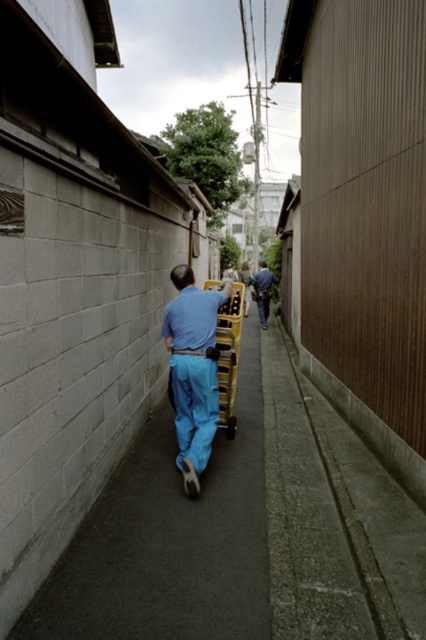
Question: Estimate the real-world distances between objects in this image. Which object is closer to the blue jeans at center?

Choices:
 (A) blue fabric pants at center
 (B) smooth asphalt pavement at center

Answer: (A)

Question: Which object is the closest to the blue fabric pants at center?

Choices:
 (A) smooth asphalt pavement at center
 (B) matte blue pants at center

Answer: (B)

Question: Which object appears closest to the camera in this image?

Choices:
 (A) matte blue pants at center
 (B) smooth asphalt pavement at center
 (C) blue fabric pants at center

Answer: (B)

Question: Can you confirm if smooth asphalt pavement at center is smaller than blue fabric pants at center?

Choices:
 (A) no
 (B) yes

Answer: (B)

Question: Can you confirm if matte blue pants at center is smaller than blue fabric pants at center?

Choices:
 (A) no
 (B) yes

Answer: (A)

Question: Does matte blue pants at center appear over blue fabric pants at center?

Choices:
 (A) yes
 (B) no

Answer: (B)